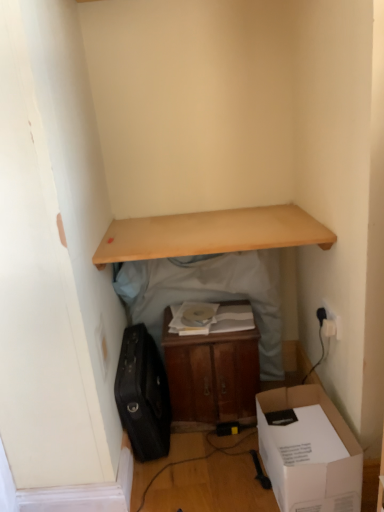
Question: Is white plastic electric outlet at upper right taller or shorter than white cardboard box at lower right?

Choices:
 (A) tall
 (B) short

Answer: (B)

Question: Is point (332, 312) closer or farther from the camera than point (314, 492)?

Choices:
 (A) farther
 (B) closer

Answer: (A)

Question: Which object is positioned farthest from the light wood shelf at upper center?

Choices:
 (A) wooden cabinet at center, the second table in the right-to-left sequence
 (B) black leather suitcase at lower left
 (C) white cardboard box at lower right
 (D) wooden shelf at upper center, placed as the 1th table when sorted from right to left
 (E) white plastic electric outlet at upper right

Answer: (C)

Question: Which is nearer to the wooden shelf at upper center, placed as the 1th table when sorted from right to left?

Choices:
 (A) white cardboard box at lower right
 (B) wooden cabinet at center, marked as the 1th table in a left-to-right arrangement
 (C) light wood shelf at upper center
 (D) black leather suitcase at lower left
 (E) white plastic electric outlet at upper right

Answer: (C)